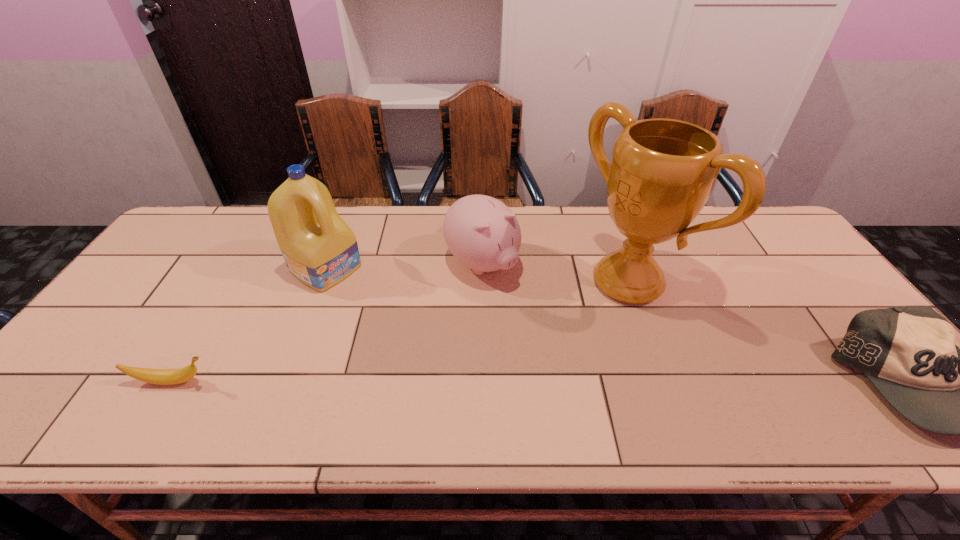
Locate an element on the screen. vacant space on the desktop that is between the leftmost object and the rightmost object and is positioned on the label of the second tallest object is located at coordinates [512, 383].

Locate an element on the screen. This screenshot has width=960, height=540. vacant space on the desktop that is between the shortest object and the baseball cap and is positioned at the snout of the piggy bank is located at coordinates (607, 383).

You are a GUI agent. You are given a task and a screenshot of the screen. Output one action in this format:
    pyautogui.click(x=<x>, y=<y>)
    Task: Click on the vacant space on the desktop that is between the banana and the baseball cap and is positioned on the front of the second object from right to left with the decoration
    This screenshot has height=540, width=960.
    Given the screenshot: What is the action you would take?
    pyautogui.click(x=464, y=383)